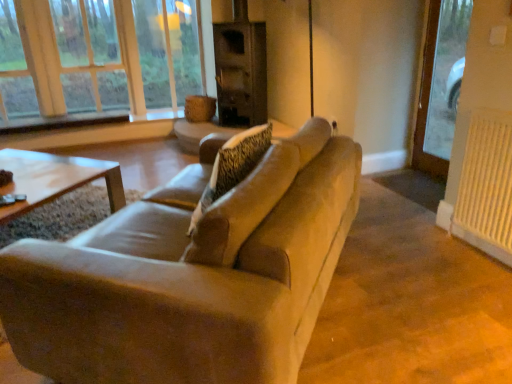
Locate an element on the screen. The height and width of the screenshot is (384, 512). unoccupied area in front of white textured radiator at right is located at coordinates (481, 273).